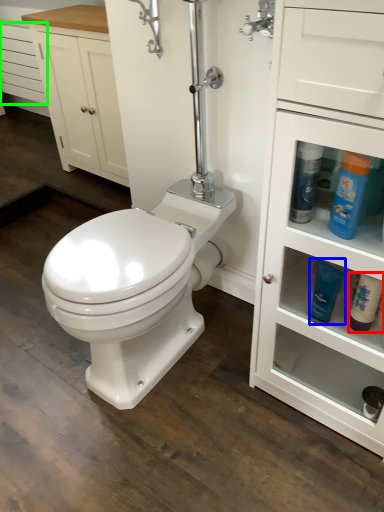
Question: Considering the real-world distances, which object is farthest from cleaning product (highlighted by a red box)? cleaning product (highlighted by a blue box) or drawer (highlighted by a green box)?

Choices:
 (A) cleaning product
 (B) drawer

Answer: (B)